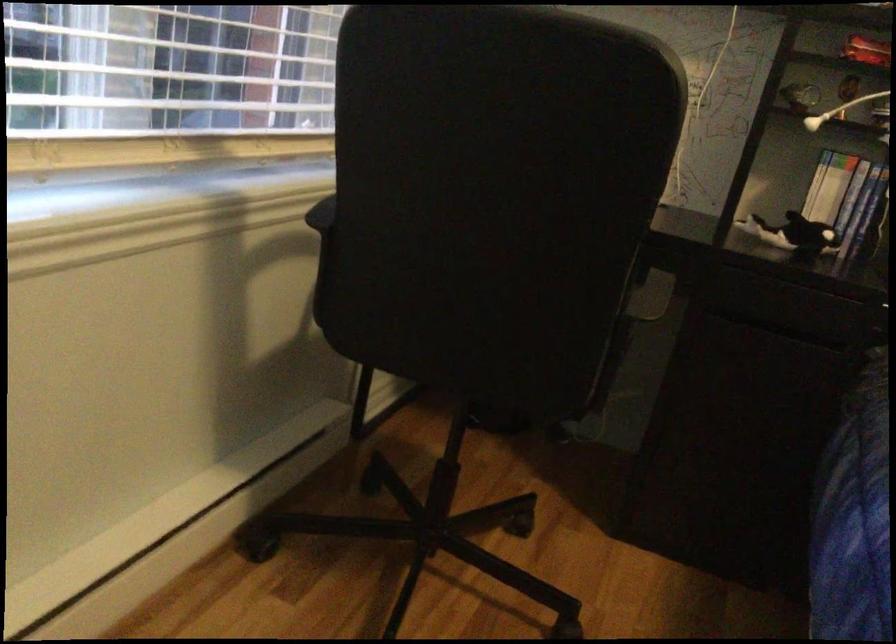
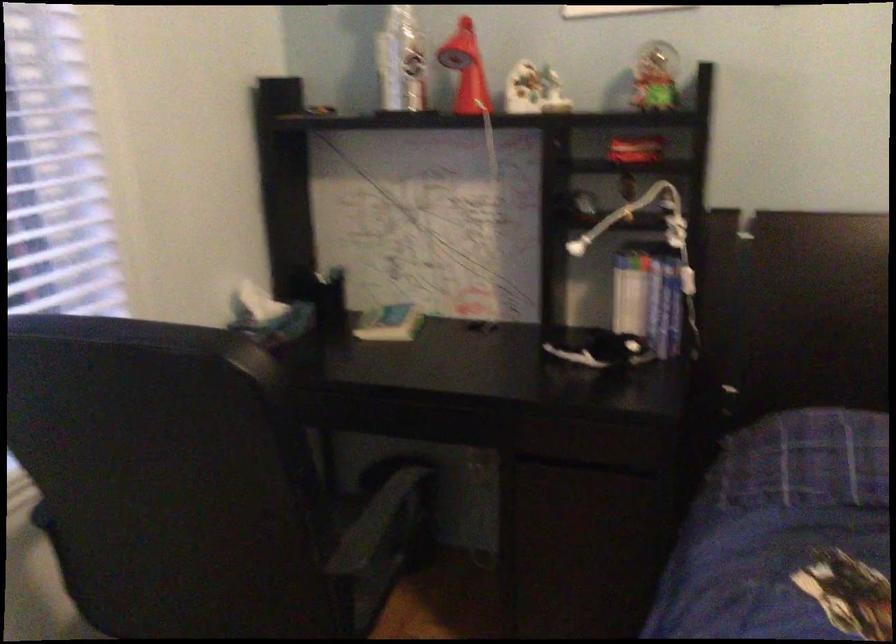
Locate, in the second image, the point that corresponds to [823,201] in the first image.

(629, 301)